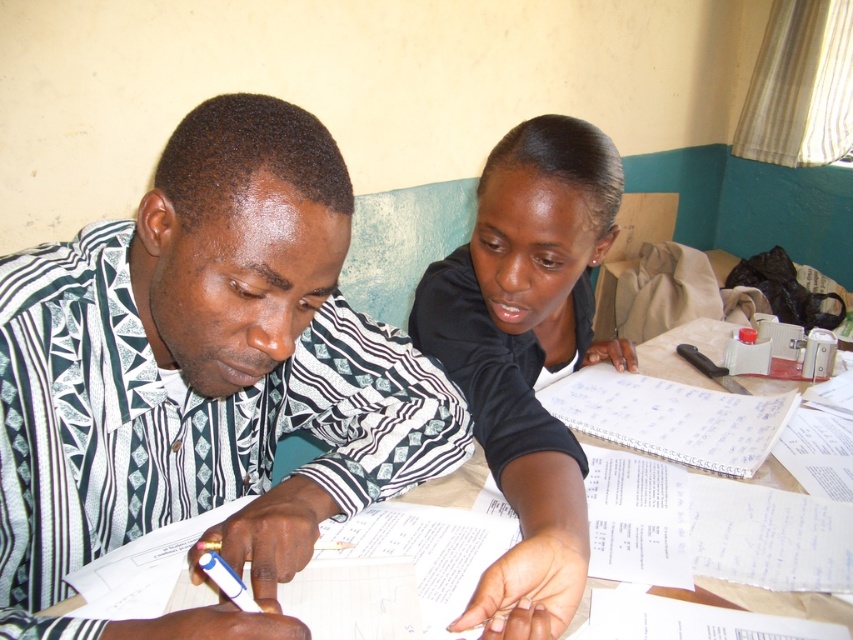
Which is above, black matte shirt at upper center or white paper at center?

black matte shirt at upper center is higher up.

Which is below, black matte shirt at upper center or white paper at center?

white paper at center is lower down.

Between point (469, 388) and point (677, 337), which one is positioned behind?

The point (677, 337) is more distant.

Where is `black matte shirt at upper center`? The height and width of the screenshot is (640, 853). black matte shirt at upper center is located at coordinates (527, 353).

Is white paper at center to the left of white plastic pen at center from the viewer's perspective?

Incorrect, white paper at center is not on the left side of white plastic pen at center.

Is point (700, 333) more distant than point (234, 588)?

Yes, point (700, 333) is farther from viewer.

The image size is (853, 640). What do you see at coordinates (672, 349) in the screenshot?
I see `white paper at center` at bounding box center [672, 349].

The height and width of the screenshot is (640, 853). I want to click on white paper at center, so click(672, 349).

Which is behind, point (94, 404) or point (699, 378)?

The point (699, 378) is behind.

Is point (18, 467) farther from viewer compared to point (643, 349)?

No, it is not.

Find the location of a particular element. This screenshot has width=853, height=640. patterned fabric shirt at center is located at coordinates (202, 374).